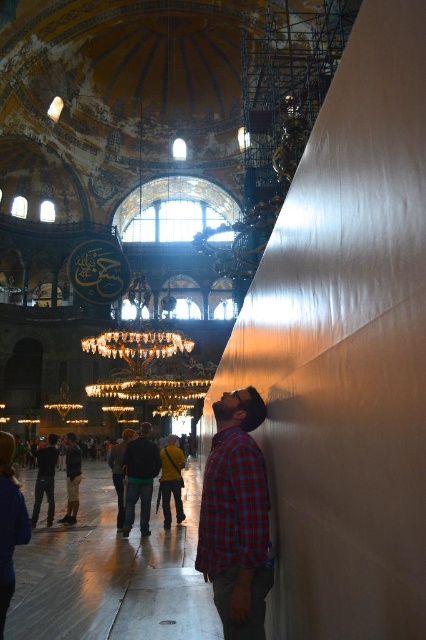
Looking at this image, which is above, plaid shirt at right or dark blue jeans at center?

plaid shirt at right is above.

Is plaid shirt at right bigger than dark blue jeans at center?

Yes.

Identify the location of plaid shirt at right. [x=236, y=516].

Does dark blue jeans at center have a greater height compared to dark gray jeans at lower left?

No.

Which is in front, point (146, 518) or point (55, 465)?

Positioned in front is point (146, 518).

Find the location of a particular element. dark blue jeans at center is located at coordinates (140, 477).

Can you confirm if plaid shirt at right is smaller than dark gray jeans at lower left?

Yes.

Which of these two, plaid shirt at right or dark gray jeans at lower left, stands shorter?

dark gray jeans at lower left

Who is more forward, (250, 538) or (55, 451)?

Point (250, 538) is more forward.

You are a GUI agent. You are given a task and a screenshot of the screen. Output one action in this format:
    pyautogui.click(x=<x>, y=<y>)
    Task: Click on the plaid shirt at right
    This screenshot has height=640, width=426.
    Given the screenshot: What is the action you would take?
    pyautogui.click(x=236, y=516)